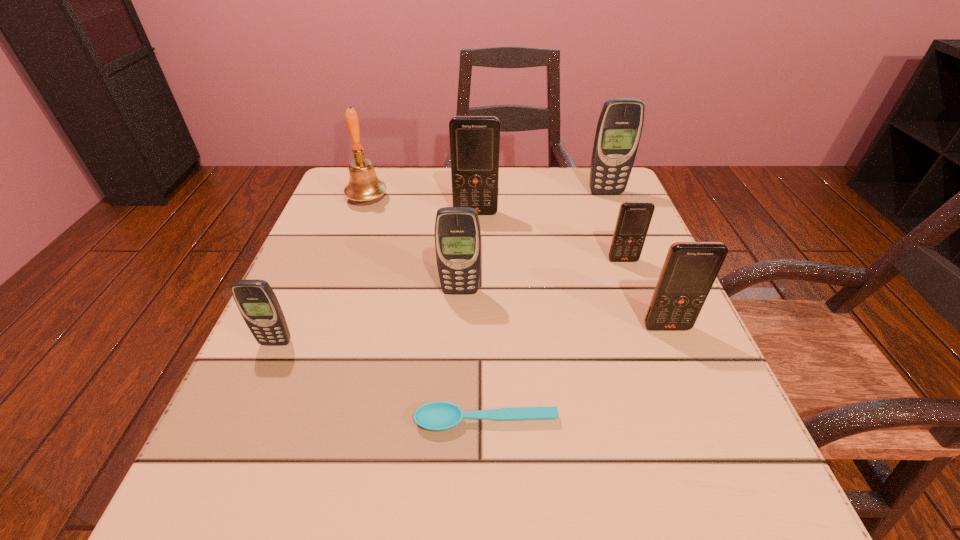
At what (x,y) coordinates should I click in order to perform the action: click on free point at the left edge. Please return your answer as a coordinate pair (x, y). Looking at the image, I should click on (212, 451).

Locate an element on the screen. This screenshot has width=960, height=540. vacant point at the right edge is located at coordinates (588, 228).

Identify the location of vacant space at the near left corner. (211, 531).

This screenshot has height=540, width=960. Find the location of `free space between the farthest orange cellular telephone and the bell`. free space between the farthest orange cellular telephone and the bell is located at coordinates (421, 206).

Find the location of a particular element. This screenshot has width=960, height=540. unoccupied position between the biggest orange cellular telephone and the farthest gray cellular telephone is located at coordinates (540, 203).

Locate an element on the screen. free space between the bell and the third nearest object is located at coordinates (517, 264).

You are a GUI agent. You are given a task and a screenshot of the screen. Output one action in this format:
    pyautogui.click(x=<x>, y=<y>)
    Task: Click on the vacant area that lies between the fourth farthest object and the leftmost gray cellular telephone
    
    Given the screenshot: What is the action you would take?
    pyautogui.click(x=449, y=301)

Where is `unoccupied position between the bell and the fifth nearest object`? unoccupied position between the bell and the fifth nearest object is located at coordinates (495, 230).

The height and width of the screenshot is (540, 960). Identify the location of vacant point located between the leftmost cellular telephone and the farthest orange cellular telephone. (375, 278).

Locate an element on the screen. The width and height of the screenshot is (960, 540). unoccupied area between the farthest orange cellular telephone and the nearest orange cellular telephone is located at coordinates coord(571,270).